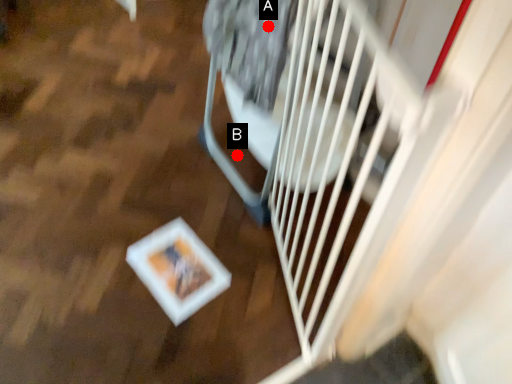
Question: Two points are circled on the image, labeled by A and B beside each circle. Which of the following is the farthest from the observer?

Choices:
 (A) A is further
 (B) B is further

Answer: (B)